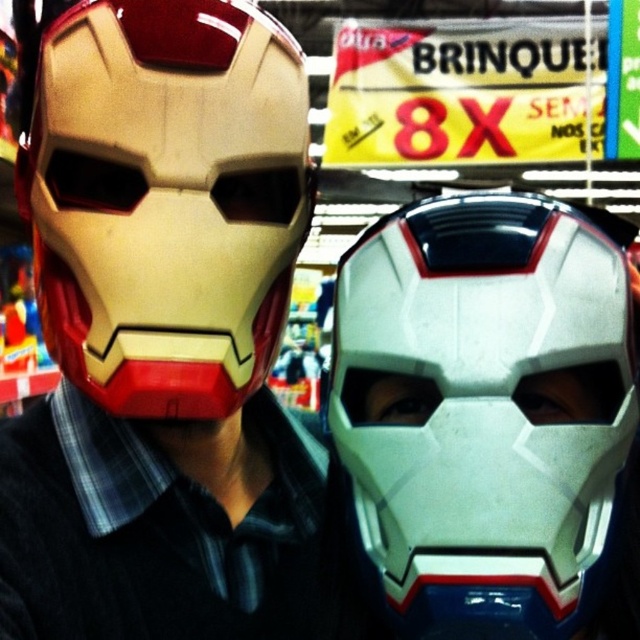
Question: Which point is closer to the camera?

Choices:
 (A) matte gold helmet at center
 (B) white matte mask at center

Answer: (B)

Question: Among these objects, which one is nearest to the camera?

Choices:
 (A) white matte mask at center
 (B) matte gold helmet at center
 (C) white matte helmet at center

Answer: (C)

Question: Does white matte helmet at center appear under matte gold helmet at center?

Choices:
 (A) no
 (B) yes

Answer: (B)

Question: Can you confirm if matte gold helmet at center is positioned above white matte mask at center?

Choices:
 (A) no
 (B) yes

Answer: (B)

Question: Is white matte helmet at center bigger than white matte mask at center?

Choices:
 (A) yes
 (B) no

Answer: (A)

Question: Which point is farther from the camera taking this photo?

Choices:
 (A) (387, 401)
 (B) (550, 310)
 (C) (275, 200)

Answer: (C)